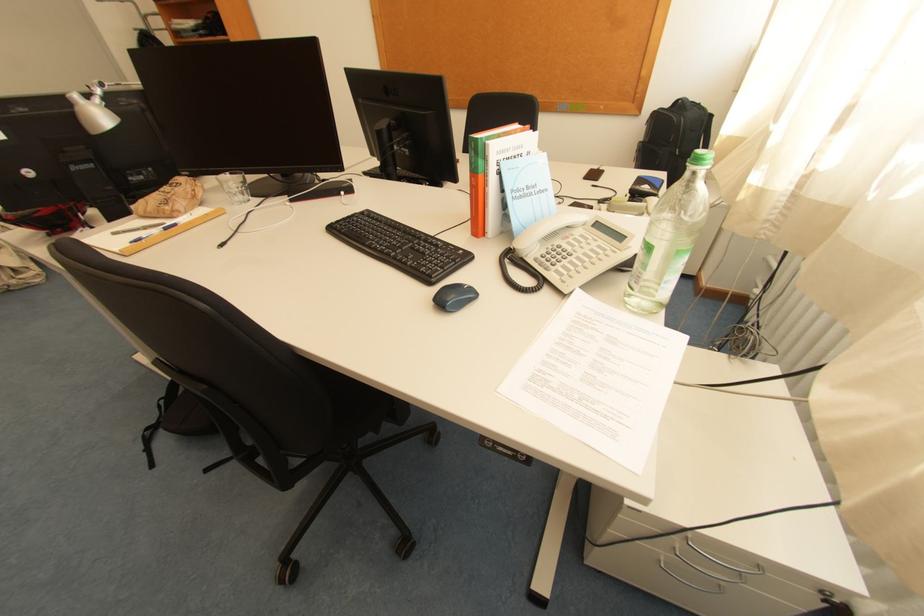
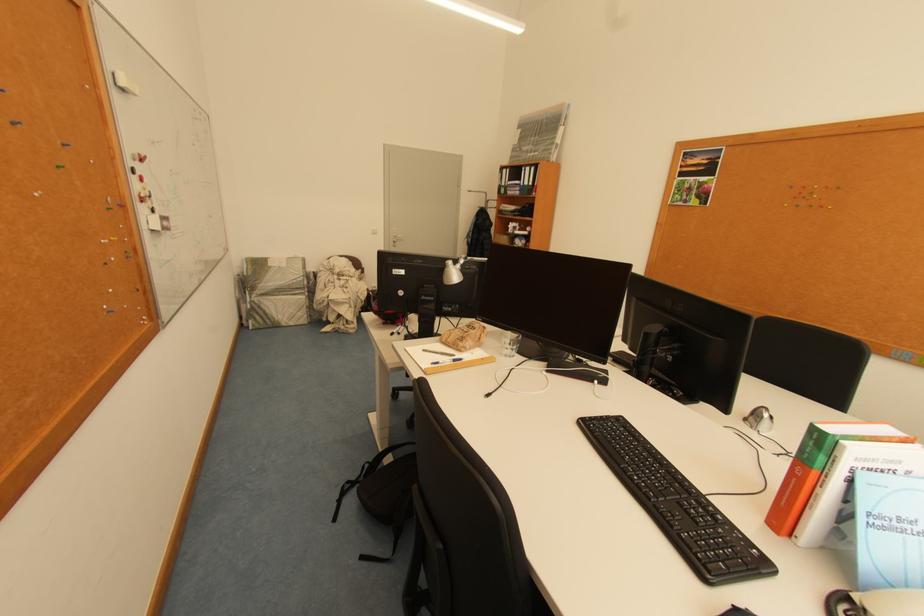
Where in the second image is the point corresponding to [526,196] from the first image?

(886, 524)